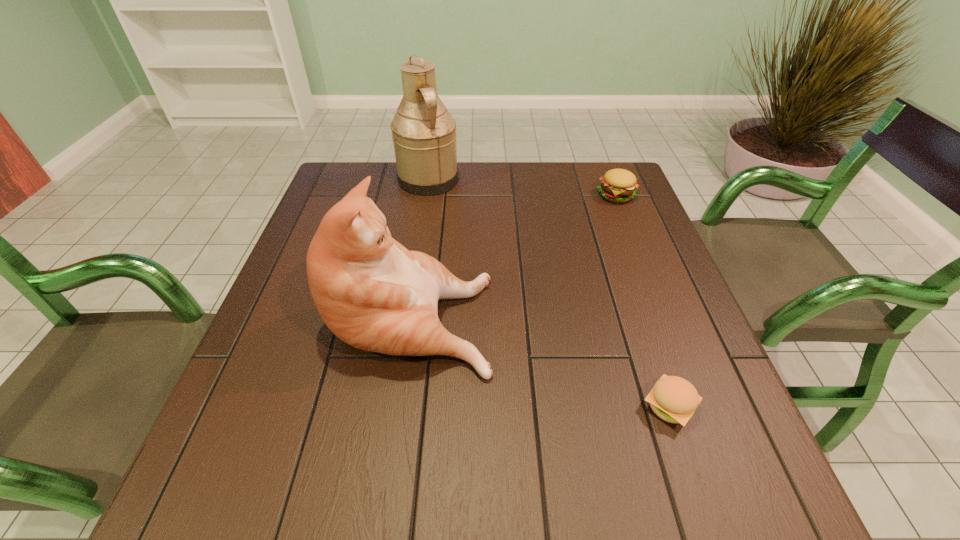
The width and height of the screenshot is (960, 540). What are the coordinates of `object that stands as the second closest to the shorter hamburger` in the screenshot? It's located at (617, 185).

Where is `vacant area in the image that satisfies the following two spatial constraints: 1. on the face of the cat; 2. on the right side of the shortest object`? The height and width of the screenshot is (540, 960). vacant area in the image that satisfies the following two spatial constraints: 1. on the face of the cat; 2. on the right side of the shortest object is located at coordinates (397, 407).

Locate an element on the screen. The width and height of the screenshot is (960, 540). free spot that satisfies the following two spatial constraints: 1. on the face of the cat; 2. on the back side of the shortest object is located at coordinates (397, 407).

Where is `vacant space that satisfies the following two spatial constraints: 1. on the face of the cat; 2. on the back side of the shorter hamburger`? The width and height of the screenshot is (960, 540). vacant space that satisfies the following two spatial constraints: 1. on the face of the cat; 2. on the back side of the shorter hamburger is located at coordinates (397, 407).

Locate an element on the screen. This screenshot has height=540, width=960. free region that satisfies the following two spatial constraints: 1. on the face of the cat; 2. on the back side of the shortest object is located at coordinates (397, 407).

Locate an element on the screen. vacant region that satisfies the following two spatial constraints: 1. on the face of the shortest object; 2. on the left side of the cat is located at coordinates (397, 407).

Where is `free space that satisfies the following two spatial constraints: 1. on the face of the cat; 2. on the right side of the shorter hamburger`? The image size is (960, 540). free space that satisfies the following two spatial constraints: 1. on the face of the cat; 2. on the right side of the shorter hamburger is located at coordinates (397, 407).

The width and height of the screenshot is (960, 540). Identify the location of vacant space that satisfies the following two spatial constraints: 1. on the front side of the pitcher; 2. on the right side of the farther hamburger. click(x=426, y=195).

You are a GUI agent. You are given a task and a screenshot of the screen. Output one action in this format:
    pyautogui.click(x=<x>, y=<y>)
    Task: Click on the vacant space that satisfies the following two spatial constraints: 1. on the face of the nearer hamburger; 2. on the right side of the cat
    The width and height of the screenshot is (960, 540).
    Given the screenshot: What is the action you would take?
    pyautogui.click(x=397, y=407)